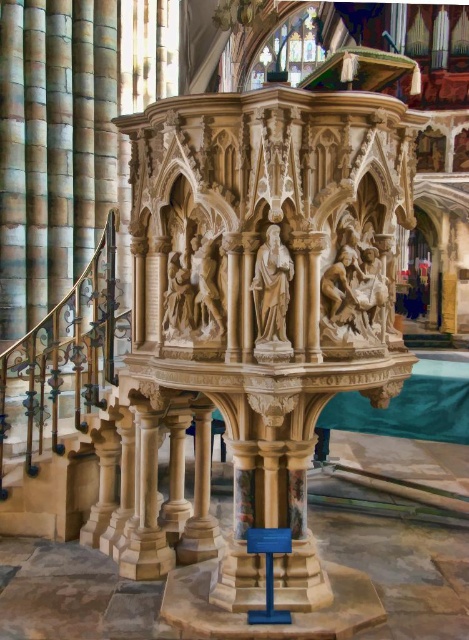
Question: Which point appears farthest from the camera in this image?

Choices:
 (A) (261, 333)
 (B) (356, 291)

Answer: (B)

Question: Can you confirm if polished stone relief at center is wider than white marble statue at center?

Choices:
 (A) no
 (B) yes

Answer: (B)

Question: Can you confirm if polished stone relief at center is positioned to the left of white marble statue at center?

Choices:
 (A) no
 (B) yes

Answer: (A)

Question: Which object is farther from the camera taking this photo?

Choices:
 (A) polished stone relief at center
 (B) white marble statue at center

Answer: (A)

Question: Which point is closer to the camera?

Choices:
 (A) polished stone relief at center
 (B) white marble statue at center

Answer: (B)

Question: Does polished stone relief at center have a greater width compared to white marble statue at center?

Choices:
 (A) no
 (B) yes

Answer: (B)